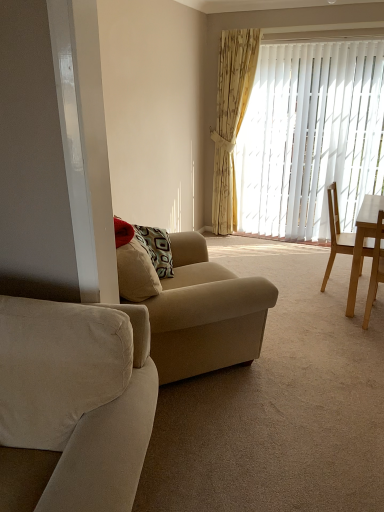
Question: Considering the relative sizes of light brown wooden chair at right, which is counted as the first chair, starting from the back, and beige fabric couch at center, acting as the first studio couch starting from the back, in the image provided, is light brown wooden chair at right, which is counted as the first chair, starting from the back, bigger than beige fabric couch at center, acting as the first studio couch starting from the back,?

Choices:
 (A) no
 (B) yes

Answer: (A)

Question: Does light brown wooden chair at right, which is counted as the first chair, starting from the back, have a smaller size compared to beige fabric couch at center, acting as the first studio couch starting from the back?

Choices:
 (A) no
 (B) yes

Answer: (B)

Question: Are light brown wooden chair at right, placed as the 2th chair when sorted from front to back, and beige fabric couch at center, acting as the first studio couch starting from the back, making contact?

Choices:
 (A) yes
 (B) no

Answer: (B)

Question: Is light brown wooden chair at right, placed as the 2th chair when sorted from front to back, at the right side of beige fabric couch at center, acting as the first studio couch starting from the back?

Choices:
 (A) no
 (B) yes

Answer: (B)

Question: Can beige fabric couch at center, acting as the first studio couch starting from the back, be found inside light brown wooden chair at right, which is counted as the first chair, starting from the back?

Choices:
 (A) no
 (B) yes

Answer: (A)

Question: From a real-world perspective, is yellow floral fabric curtain at upper right above or below white vertical blinds at center?

Choices:
 (A) below
 (B) above

Answer: (B)

Question: In terms of height, does yellow floral fabric curtain at upper right look taller or shorter compared to white vertical blinds at center?

Choices:
 (A) tall
 (B) short

Answer: (A)

Question: Based on their sizes in the image, would you say yellow floral fabric curtain at upper right is bigger or smaller than white vertical blinds at center?

Choices:
 (A) big
 (B) small

Answer: (B)

Question: Choose the correct answer: Is yellow floral fabric curtain at upper right inside white vertical blinds at center or outside it?

Choices:
 (A) outside
 (B) inside

Answer: (A)

Question: Considering the positions of beige fabric couch at center, placed as the 2th studio couch when sorted from front to back, and light brown wooden chair at right, which is the first chair in front-to-back order, in the image, is beige fabric couch at center, placed as the 2th studio couch when sorted from front to back, taller or shorter than light brown wooden chair at right, which is the first chair in front-to-back order,?

Choices:
 (A) tall
 (B) short

Answer: (A)

Question: Choose the correct answer: Is beige fabric couch at center, acting as the first studio couch starting from the back, inside light brown wooden chair at right, which is the first chair in front-to-back order, or outside it?

Choices:
 (A) inside
 (B) outside

Answer: (B)

Question: Considering the positions of beige fabric couch at center, placed as the 2th studio couch when sorted from front to back, and light brown wooden chair at right, acting as the 2th chair starting from the back, in the image, is beige fabric couch at center, placed as the 2th studio couch when sorted from front to back, wider or thinner than light brown wooden chair at right, acting as the 2th chair starting from the back,?

Choices:
 (A) thin
 (B) wide

Answer: (B)

Question: Is beige fabric couch at center, acting as the first studio couch starting from the back, in front of or behind light brown wooden chair at right, which is the first chair in front-to-back order, in the image?

Choices:
 (A) behind
 (B) front

Answer: (B)

Question: From a real-world perspective, is light brown wooden chair at right, acting as the 2th chair starting from the back, physically located above or below yellow floral fabric curtain at upper right?

Choices:
 (A) below
 (B) above

Answer: (A)

Question: Is light brown wooden chair at right, acting as the 2th chair starting from the back, taller or shorter than yellow floral fabric curtain at upper right?

Choices:
 (A) tall
 (B) short

Answer: (B)